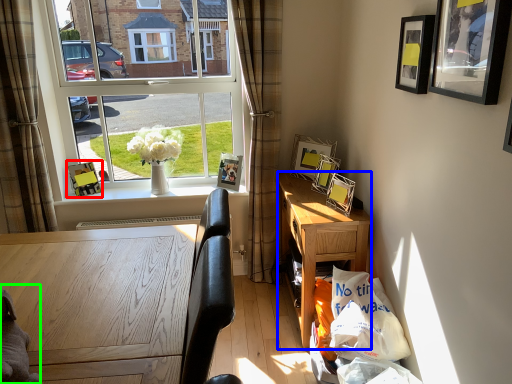
Question: Which object is positioned closest to picture frame (highlighted by a red box)? Select from desk (highlighted by a blue box) and animal (highlighted by a green box).

Choices:
 (A) desk
 (B) animal

Answer: (A)